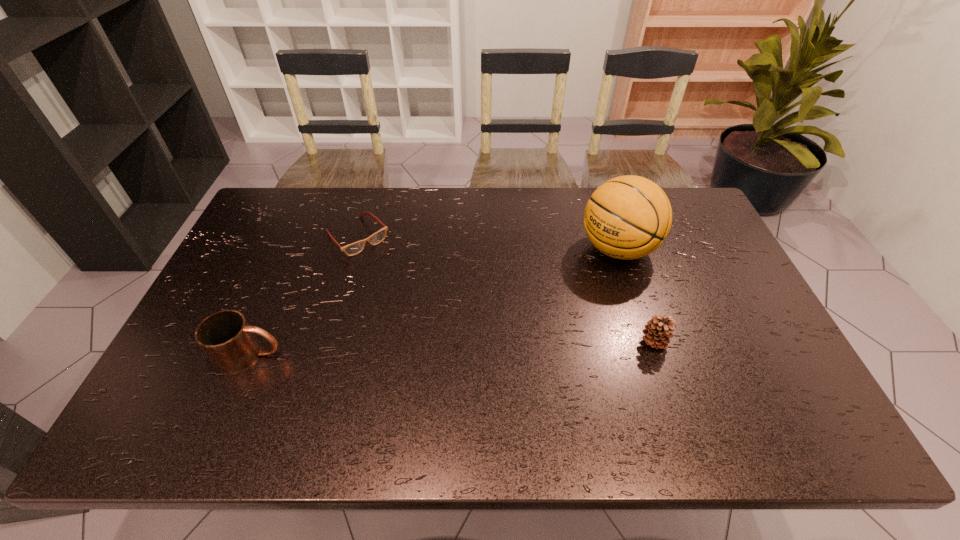
Find the location of `mug`. mug is located at coordinates (226, 338).

Where is `pinecone`? The width and height of the screenshot is (960, 540). pinecone is located at coordinates (657, 330).

Find the location of a particular element. The width and height of the screenshot is (960, 540). the shortest object is located at coordinates (355, 248).

Where is `the tallest object`? The image size is (960, 540). the tallest object is located at coordinates (627, 217).

The image size is (960, 540). Identify the location of free spot located 0.260m on the side of the mug with the handle. (386, 355).

Identify the location of vacant space located 0.170m on the back of the pinecone. The image size is (960, 540). (635, 284).

At what (x,y) coordinates should I click in order to perform the action: click on blank area located 0.340m on the front-facing side of the spectacles. Please return your answer as a coordinate pair (x, y). Looking at the image, I should click on (438, 321).

Where is `vacant space located on the front-facing side of the spectacles`? The width and height of the screenshot is (960, 540). vacant space located on the front-facing side of the spectacles is located at coordinates pyautogui.click(x=393, y=274).

The width and height of the screenshot is (960, 540). Identify the location of vacant space situated on the front-facing side of the spectacles. (395, 276).

The width and height of the screenshot is (960, 540). I want to click on vacant space located 0.280m on the surface of the tallest object near the brand logo, so click(523, 310).